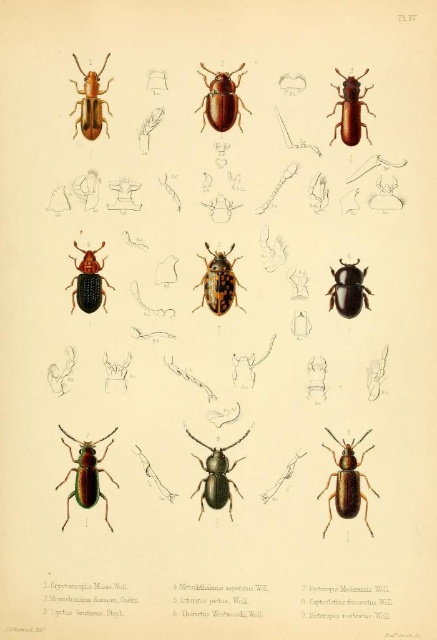
Question: Which point is farther to the camera?

Choices:
 (A) (328, 429)
 (B) (208, 116)

Answer: (A)

Question: Where is green metallic beetle at lower left located in relation to shiny brown beetle at center in the image?

Choices:
 (A) right
 (B) left

Answer: (B)

Question: Is green metallic beetle at lower left thinner than matte brown beetle at upper left?

Choices:
 (A) no
 (B) yes

Answer: (A)

Question: Which of the following is the closest to the observer?

Choices:
 (A) marbled brown beetle at center
 (B) green metallic beetle at lower left

Answer: (B)

Question: Which object appears farthest from the camera in this image?

Choices:
 (A) matte brown beetle at center
 (B) matte brown beetle at upper left
 (C) brown matte beetle at upper right

Answer: (A)

Question: In this image, where is marbled brown beetle at center located relative to matte brown beetle at upper left?

Choices:
 (A) below
 (B) above

Answer: (A)